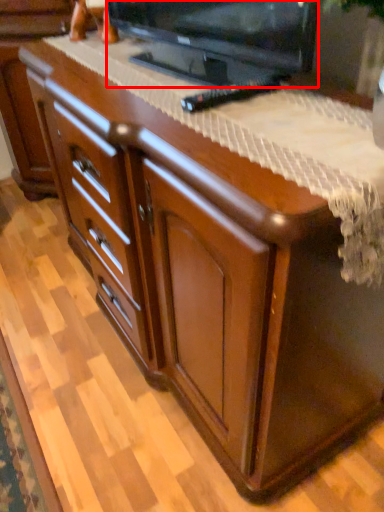
Question: In this image, where is television (annotated by the red box) located relative to remote?

Choices:
 (A) left
 (B) right

Answer: (A)